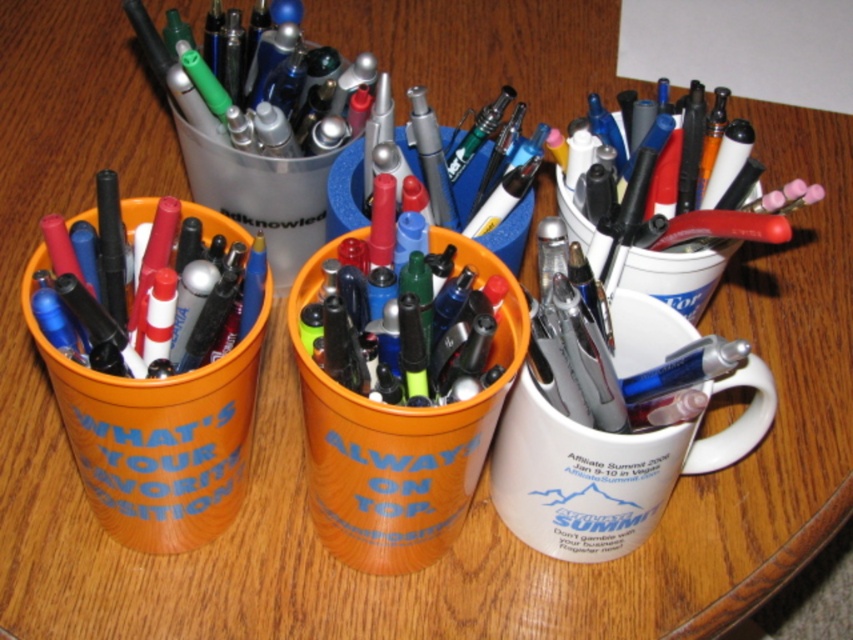
You are organizing a small office supply closet and need to place the white ceramic mug at center and the metallic silver pen at center on a shelf. The shelf has limited space, so you want to arrange them in the same order as they appear in the image. Which object should be placed on the left side of the shelf?

The metallic silver pen at center should be placed on the left side of the shelf because in the image, the white ceramic mug at center is positioned on the right side of the metallic silver pen at center.

You have two mugs, a white ceramic mug at center and a white glossy mug at upper right. You want to place a spoon between them. What is the minimum length the spoon should be to reach both mugs?

The white ceramic mug at center is 14.18 centimeters from the white glossy mug at upper right. Therefore, the spoon needs to be at least 14.18 centimeters long to span the distance between them.